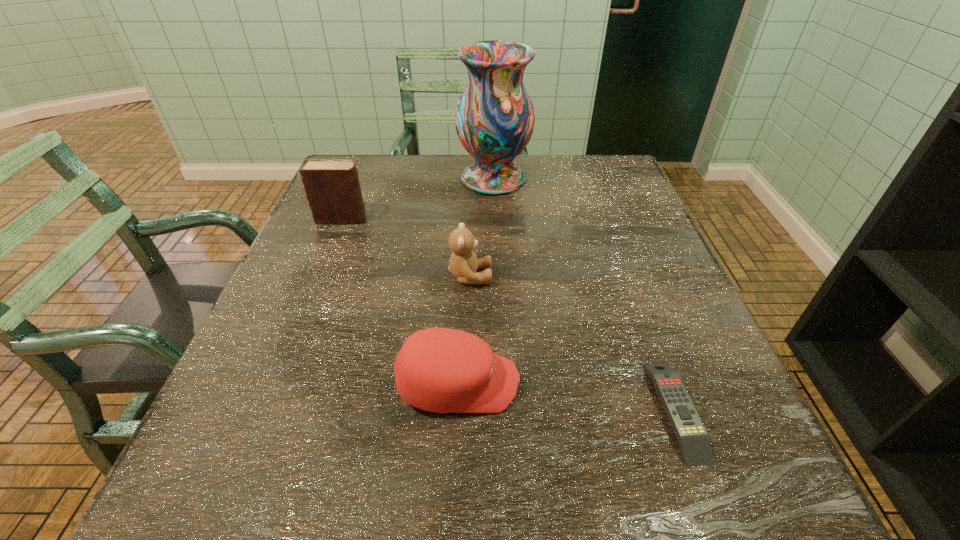
Identify the location of vase. (494, 119).

Image resolution: width=960 pixels, height=540 pixels. Find the location of `the tallest object`. the tallest object is located at coordinates (494, 119).

The height and width of the screenshot is (540, 960). What are the coordinates of `the leftmost object` in the screenshot? It's located at (332, 187).

The height and width of the screenshot is (540, 960). Identify the location of the second tallest object. (332, 187).

Locate an element on the screen. the third farthest object is located at coordinates (463, 264).

Locate an element on the screen. the third tallest object is located at coordinates (463, 264).

Find the location of `cap`. cap is located at coordinates (442, 370).

Find the location of a particular element. the shortest object is located at coordinates (692, 437).

The width and height of the screenshot is (960, 540). I want to click on the rightmost object, so click(692, 437).

Locate an element on the screen. free space located 0.380m on the front of the tallest object is located at coordinates (499, 305).